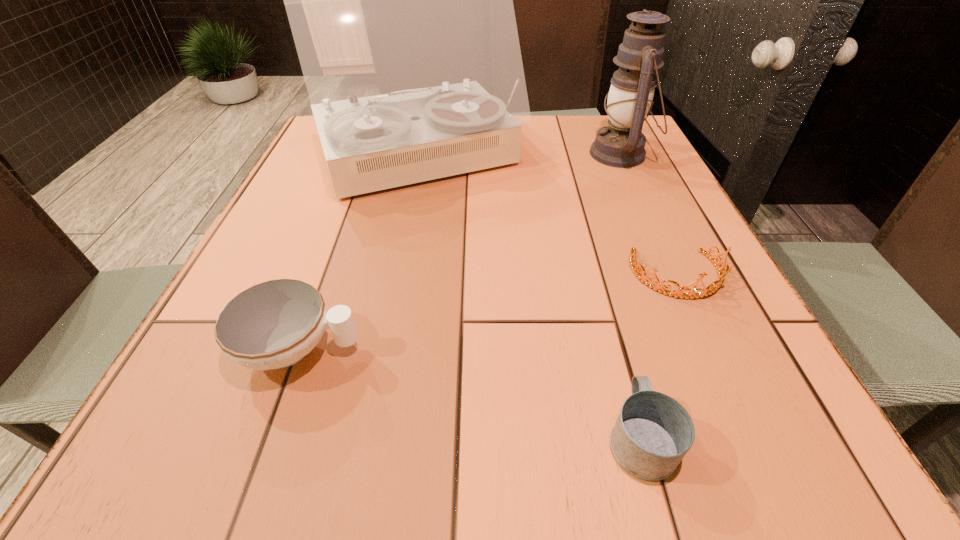
Image resolution: width=960 pixels, height=540 pixels. I want to click on record player, so click(x=400, y=0).

Identify the location of the second tallest object. Image resolution: width=960 pixels, height=540 pixels. [621, 144].

This screenshot has height=540, width=960. What are the coordinates of `the second nearest object` in the screenshot? It's located at (274, 324).

Image resolution: width=960 pixels, height=540 pixels. What are the coordinates of `the third nearest object` in the screenshot? It's located at (722, 272).

Identify the location of the third object from right to left. The image size is (960, 540). (653, 432).

You are a GUI agent. You are given a task and a screenshot of the screen. Output one action in this format:
    pyautogui.click(x=<x>, y=<y>)
    Task: Click on the nearest object
    Image resolution: width=960 pixels, height=540 pixels.
    Given the screenshot: What is the action you would take?
    pyautogui.click(x=653, y=432)

At what (x,y) coordinates should I click in order to perform the action: click on vacant region located 0.260m on the right of the record player. Please return your answer as a coordinate pair (x, y). Image resolution: width=960 pixels, height=540 pixels. Looking at the image, I should click on (624, 158).

What are the coordinates of `vacant space situated 0.190m on the front of the oil lamp` in the screenshot? It's located at (652, 222).

The width and height of the screenshot is (960, 540). I want to click on vacant region located 0.360m on the side with the handle of the fourth farthest object, so click(x=584, y=349).

At what (x,y) coordinates should I click in order to perform the action: click on vacant area located 0.220m on the front-facing side of the tiara. Please return your answer as a coordinate pair (x, y). The height and width of the screenshot is (540, 960). Looking at the image, I should click on (744, 417).